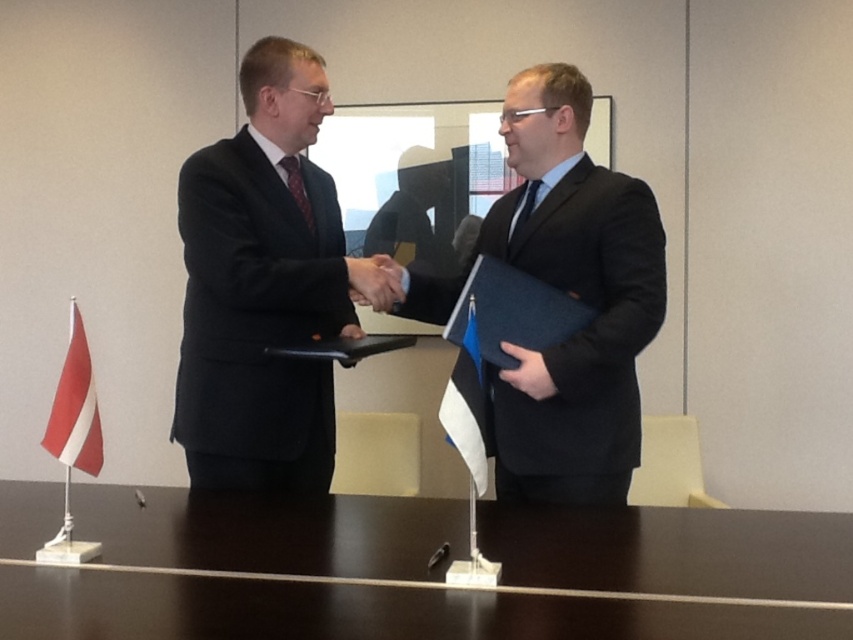
Question: Among these objects, which one is farthest from the camera?

Choices:
 (A) dark wood table at center
 (B) black matte suit at center
 (C) matte black suit at center
 (D) black fabric hand at center

Answer: (C)

Question: Observing the image, what is the correct spatial positioning of matte black suit at center in reference to black fabric hand at center?

Choices:
 (A) below
 (B) above

Answer: (B)

Question: Does matte black suit at center appear on the left side of black fabric hand at center?

Choices:
 (A) no
 (B) yes

Answer: (B)

Question: Which point is farther to the camera?

Choices:
 (A) black matte suit at center
 (B) dark wood table at center

Answer: (A)

Question: Considering the relative positions of matte black suit at center and black matte suit at center in the image provided, where is matte black suit at center located with respect to black matte suit at center?

Choices:
 (A) right
 (B) left

Answer: (B)

Question: Considering the real-world distances, which object is closest to the matte black suit at center?

Choices:
 (A) dark wood table at center
 (B) black fabric hand at center

Answer: (A)